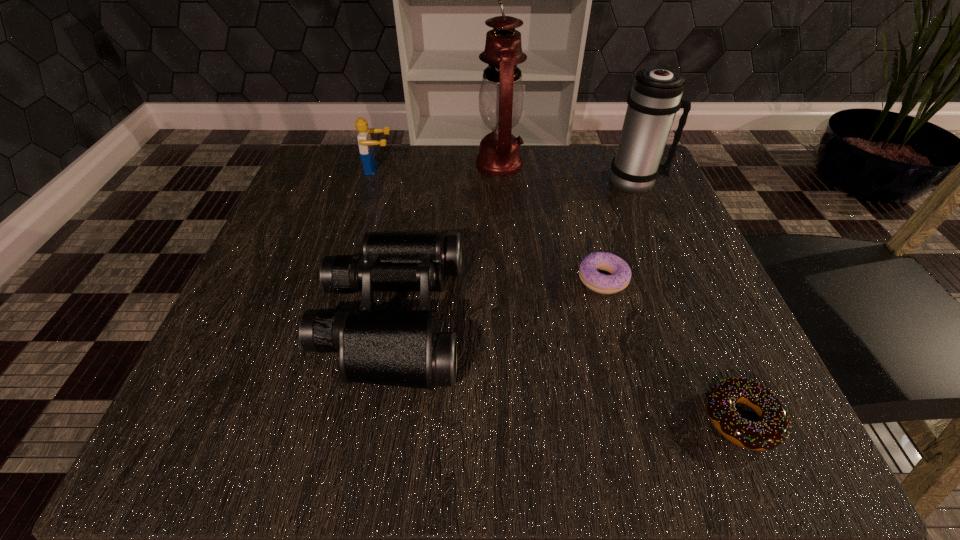
In the image, there is a desktop. Where is `vacant space at the far right corner`? The image size is (960, 540). vacant space at the far right corner is located at coordinates (596, 159).

This screenshot has width=960, height=540. I want to click on vacant space at the near right corner of the desktop, so click(x=675, y=423).

What are the coordinates of `vacant region between the binoculars and the right doughnut` in the screenshot? It's located at (565, 368).

Where is `free space between the tallest object and the fifth shortest object`? free space between the tallest object and the fifth shortest object is located at coordinates (567, 172).

You are a GUI agent. You are given a task and a screenshot of the screen. Output one action in this format:
    pyautogui.click(x=<x>, y=<y>)
    Task: Click on the vacant region between the third object from right to left and the thermos bottle
    
    Given the screenshot: What is the action you would take?
    pyautogui.click(x=619, y=230)

The image size is (960, 540). Find the location of `free space between the second tallest object and the right doughnut`. free space between the second tallest object and the right doughnut is located at coordinates (688, 300).

Where is `unoccupied position between the left doughnut and the binoculars`? The width and height of the screenshot is (960, 540). unoccupied position between the left doughnut and the binoculars is located at coordinates (496, 298).

This screenshot has height=540, width=960. Identify the location of empty space that is in between the oil lamp and the Lego. (439, 167).

Where is `vacant region between the fourth object from left to right and the binoculars`? vacant region between the fourth object from left to right and the binoculars is located at coordinates (496, 298).

This screenshot has width=960, height=540. I want to click on blank region between the nearer doughnut and the Lego, so click(560, 294).